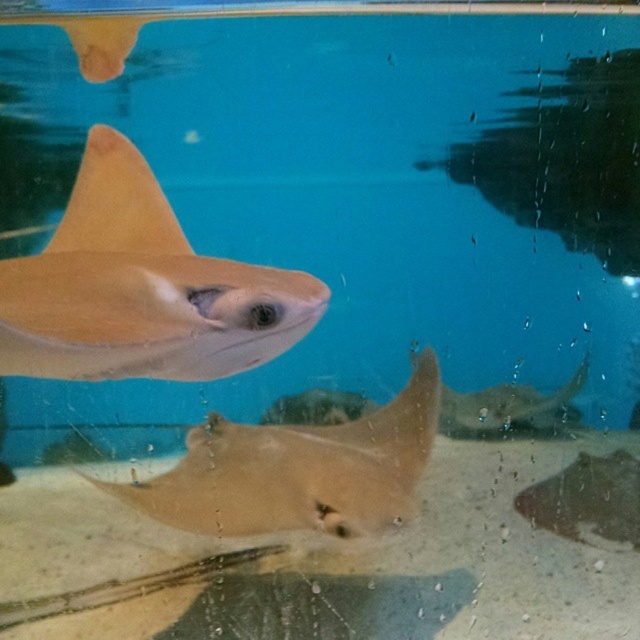
Question: Which of these objects is positioned closest to the light brown matte stingray at upper left?

Choices:
 (A) light brown matte stingray at center
 (B) light tan smooth fin at upper left

Answer: (B)

Question: Does light brown matte stingray at center come in front of light tan smooth fin at upper left?

Choices:
 (A) yes
 (B) no

Answer: (B)

Question: Does light brown matte stingray at upper left appear on the right side of light tan smooth fin at upper left?

Choices:
 (A) no
 (B) yes

Answer: (B)

Question: Is light brown matte stingray at upper left bigger than light brown matte stingray at center?

Choices:
 (A) no
 (B) yes

Answer: (B)

Question: Which point is closer to the camera?

Choices:
 (A) light tan smooth fin at upper left
 (B) light brown matte stingray at upper left

Answer: (B)

Question: Among these points, which one is nearest to the camera?

Choices:
 (A) (20, 298)
 (B) (116, 492)
 (C) (88, 205)

Answer: (A)